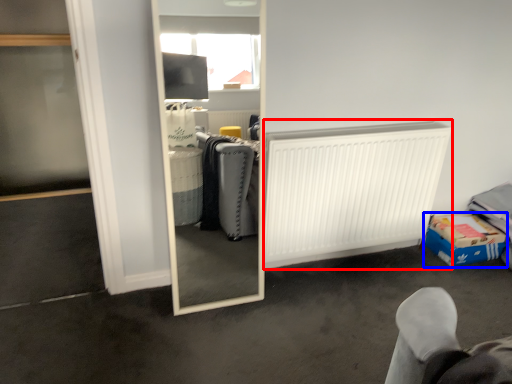
Question: Which object is further to the camera taking this photo, radiator (highlighted by a red box) or cardboard box (highlighted by a blue box)?

Choices:
 (A) radiator
 (B) cardboard box

Answer: (B)